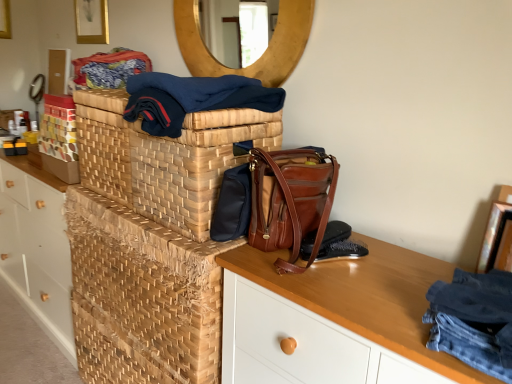
Question: Is textured woven fabric at upper left positioned behind wooden desk at center?

Choices:
 (A) no
 (B) yes

Answer: (B)

Question: Is textured woven fabric at upper left far away from wooden desk at center?

Choices:
 (A) no
 (B) yes

Answer: (B)

Question: Is textured woven fabric at upper left facing towards wooden desk at center?

Choices:
 (A) yes
 (B) no

Answer: (B)

Question: Does textured woven fabric at upper left have a greater width compared to wooden desk at center?

Choices:
 (A) no
 (B) yes

Answer: (A)

Question: Is textured woven fabric at upper left shorter than wooden desk at center?

Choices:
 (A) yes
 (B) no

Answer: (A)

Question: Considering the relative sizes of textured woven fabric at upper left and wooden desk at center in the image provided, is textured woven fabric at upper left thinner than wooden desk at center?

Choices:
 (A) no
 (B) yes

Answer: (B)

Question: Does black leather shoe at lower right, acting as the first shoe starting from the top, have a lesser height compared to textured woven fabric at upper left?

Choices:
 (A) yes
 (B) no

Answer: (A)

Question: Is black leather shoe at lower right, the second shoe in the bottom-to-top sequence, outside of textured woven fabric at upper left?

Choices:
 (A) yes
 (B) no

Answer: (A)

Question: Does black leather shoe at lower right, the second shoe in the bottom-to-top sequence, come in front of textured woven fabric at upper left?

Choices:
 (A) yes
 (B) no

Answer: (A)

Question: Is black leather shoe at lower right, acting as the first shoe starting from the top, at the right side of textured woven fabric at upper left?

Choices:
 (A) yes
 (B) no

Answer: (A)

Question: Can you confirm if black leather shoe at lower right, the second shoe in the bottom-to-top sequence, is thinner than textured woven fabric at upper left?

Choices:
 (A) no
 (B) yes

Answer: (B)

Question: From the image's perspective, would you say black leather shoe at lower right, the second shoe in the bottom-to-top sequence, is shown under textured woven fabric at upper left?

Choices:
 (A) no
 (B) yes

Answer: (B)

Question: Is wooden circular mirror at upper center facing towards woven wood basket at center?

Choices:
 (A) no
 (B) yes

Answer: (A)